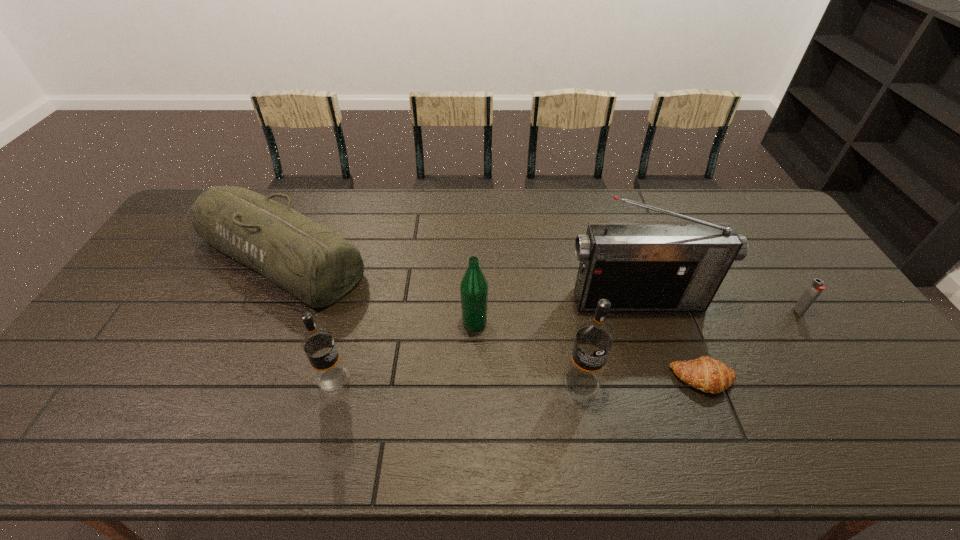
Locate an element on the screen. The width and height of the screenshot is (960, 540). free space at the far edge of the desktop is located at coordinates (473, 210).

Image resolution: width=960 pixels, height=540 pixels. I want to click on vacant area at the near edge of the desktop, so pyautogui.click(x=596, y=406).

This screenshot has height=540, width=960. Find the location of `vacant space at the left edge`. vacant space at the left edge is located at coordinates (142, 308).

Locate an element on the screen. The height and width of the screenshot is (540, 960). vacant space at the right edge is located at coordinates (796, 280).

Find the location of a particular element. This screenshot has width=960, height=540. vacant space at the near left corner of the desktop is located at coordinates (99, 399).

This screenshot has height=540, width=960. I want to click on vacant area at the near right corner, so click(x=891, y=384).

At what (x,y) coordinates should I click in order to perform the action: click on free area in between the igniter and the crescent roll. Please return your answer as a coordinate pair (x, y). This screenshot has width=960, height=540. Looking at the image, I should click on (751, 345).

In order to click on free point between the tallest object and the duffel bag in this screenshot , I will do `click(459, 278)`.

The width and height of the screenshot is (960, 540). In order to click on vacant space in between the igniter and the bottle in this screenshot , I will do `click(636, 316)`.

This screenshot has height=540, width=960. What are the coordinates of `free spot between the rightmost object and the third object from left to right` in the screenshot? It's located at (636, 316).